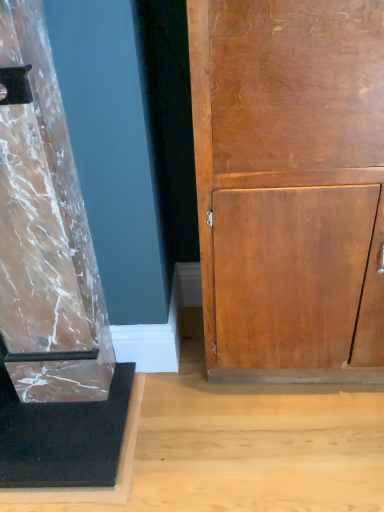
What is the approximate height of wooden cupboard at right?

The height of wooden cupboard at right is 1.11 meters.

What is the approximate width of wooden cupboard at right?

The width of wooden cupboard at right is 17.72 inches.

What are the coordinates of `wooden cupboard at right` in the screenshot? It's located at (290, 188).

Measure the distance between point (241, 324) and camera.

A distance of 1.22 meters exists between point (241, 324) and camera.

What do you see at coordinates (290, 188) in the screenshot? The image size is (384, 512). I see `wooden cupboard at right` at bounding box center [290, 188].

I want to click on wooden cupboard at right, so click(x=290, y=188).